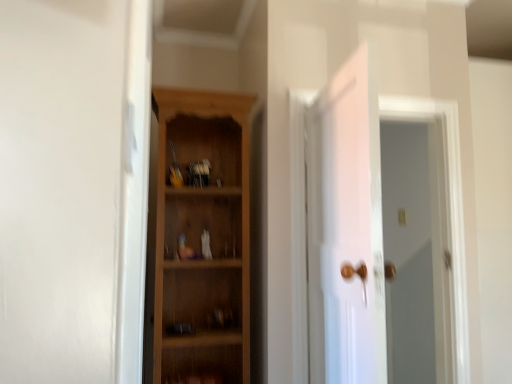
Question: Is white glossy door at center taller or shorter than white glossy door at upper right?

Choices:
 (A) short
 (B) tall

Answer: (A)

Question: Based on their positions, is white glossy door at center located to the left or right of white glossy door at upper right?

Choices:
 (A) right
 (B) left

Answer: (B)

Question: Considering the real-world distances, which object is farthest from the white glossy door at upper right?

Choices:
 (A) wooden cabinet at center
 (B) white glossy door at center

Answer: (A)

Question: Estimate the real-world distances between objects in this image. Which object is farther from the wooden cabinet at center?

Choices:
 (A) white glossy door at upper right
 (B) white glossy door at center

Answer: (A)